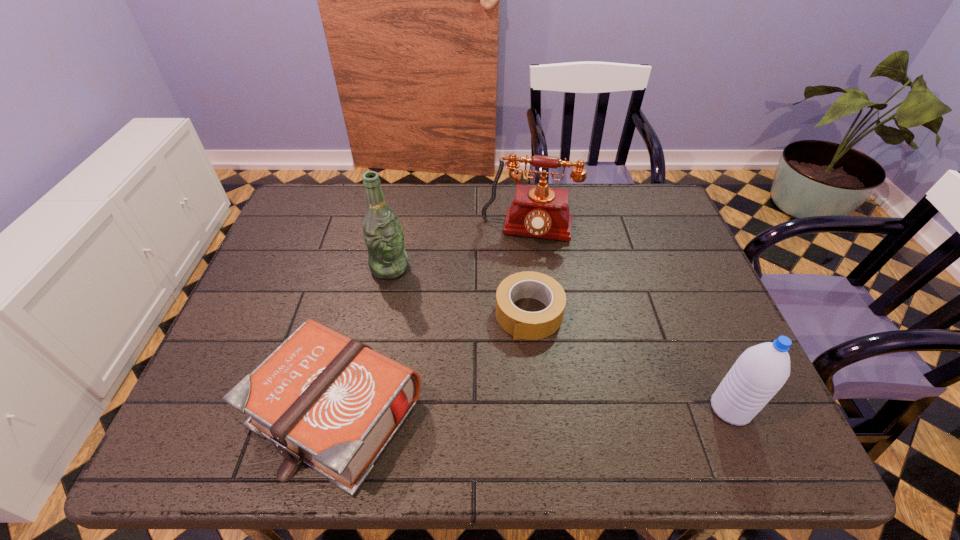
At what (x,y) coordinates should I click in order to perform the action: click on Bible. Please return your answer as a coordinate pair (x, y). Looking at the image, I should click on click(x=323, y=399).

This screenshot has height=540, width=960. Find the location of `water bottle`. water bottle is located at coordinates (759, 373).

The width and height of the screenshot is (960, 540). I want to click on the tallest object, so click(x=387, y=259).

At what (x,y) coordinates should I click in order to perform the action: click on the fourth nearest object. Please return your answer as a coordinate pair (x, y). The height and width of the screenshot is (540, 960). Looking at the image, I should click on (387, 259).

Find the location of a particular element. The width and height of the screenshot is (960, 540). the farthest object is located at coordinates (540, 211).

Identify the location of duct tape. Image resolution: width=960 pixels, height=540 pixels. (521, 324).

Find the location of a particular element. This screenshot has height=540, width=960. the third farthest object is located at coordinates (521, 324).

You are a GUI agent. You are given a task and a screenshot of the screen. Output one action in this format:
    pyautogui.click(x=<x>, y=<y>)
    Task: Click on the vacant point located on the back of the Bible
    Image resolution: width=960 pixels, height=540 pixels.
    Given the screenshot: What is the action you would take?
    pyautogui.click(x=370, y=273)

Locate an element on the screen. The image size is (960, 540). vacant region located 0.190m on the back of the rightmost object is located at coordinates (693, 321).

Where is `vacant area situated 0.250m on the surface of the tallest object`? This screenshot has width=960, height=540. vacant area situated 0.250m on the surface of the tallest object is located at coordinates (466, 332).